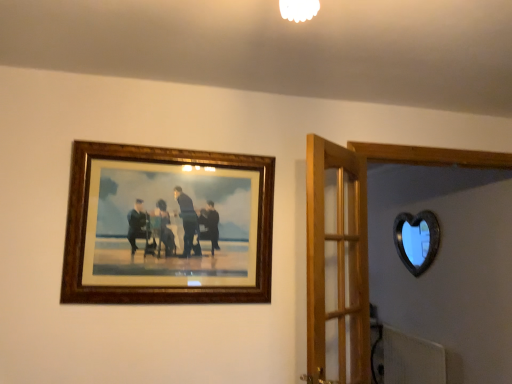
Question: Should I look upward or downward to see wooden frame at upper left?

Choices:
 (A) up
 (B) down

Answer: (B)

Question: Does wooden door at center have a lesser height compared to wooden frame at upper left?

Choices:
 (A) no
 (B) yes

Answer: (A)

Question: Is wooden door at center surrounding wooden frame at upper left?

Choices:
 (A) yes
 (B) no

Answer: (B)

Question: Can you confirm if wooden door at center is bigger than wooden frame at upper left?

Choices:
 (A) no
 (B) yes

Answer: (B)

Question: Are wooden door at center and wooden frame at upper left far apart?

Choices:
 (A) no
 (B) yes

Answer: (A)

Question: From a real-world perspective, is wooden door at center beneath wooden frame at upper left?

Choices:
 (A) yes
 (B) no

Answer: (A)

Question: Can you confirm if wooden door at center is positioned to the left of wooden frame at upper left?

Choices:
 (A) yes
 (B) no

Answer: (B)

Question: Is wooden frame at upper left to the right of wooden door at center from the viewer's perspective?

Choices:
 (A) yes
 (B) no

Answer: (B)

Question: From a real-world perspective, does wooden frame at upper left sit lower than wooden door at center?

Choices:
 (A) no
 (B) yes

Answer: (A)

Question: Considering the relative sizes of wooden frame at upper left and wooden door at center in the image provided, is wooden frame at upper left wider than wooden door at center?

Choices:
 (A) yes
 (B) no

Answer: (B)

Question: Can you confirm if wooden frame at upper left is smaller than wooden door at center?

Choices:
 (A) no
 (B) yes

Answer: (B)

Question: Is wooden frame at upper left far away from wooden door at center?

Choices:
 (A) yes
 (B) no

Answer: (B)

Question: Could you tell me if wooden frame at upper left is turned towards wooden door at center?

Choices:
 (A) no
 (B) yes

Answer: (A)

Question: Is wooden frame at upper left next to black glass heart at upper right and touching it?

Choices:
 (A) no
 (B) yes

Answer: (A)